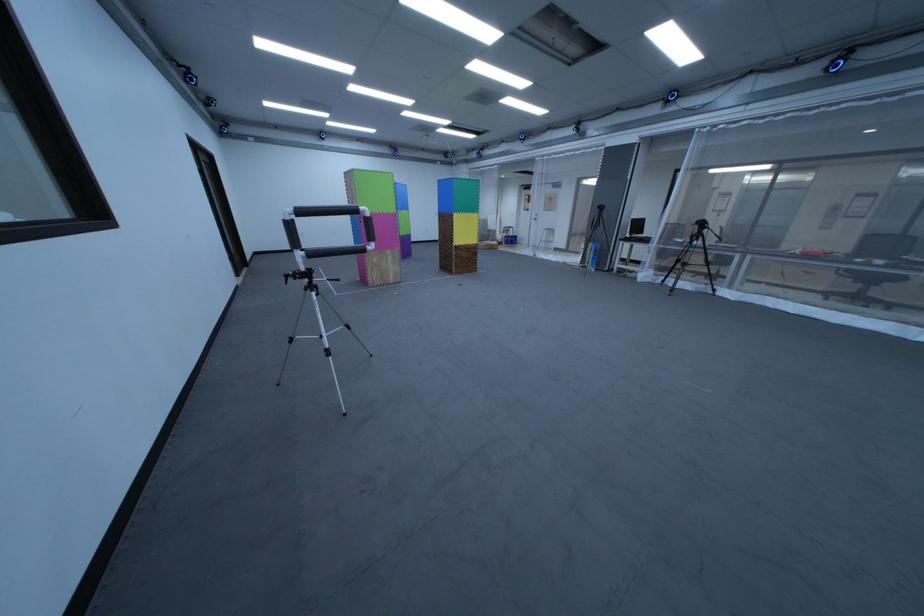
The location [371,190] corresponds to which object?

It corresponds to the green foam block in the image.